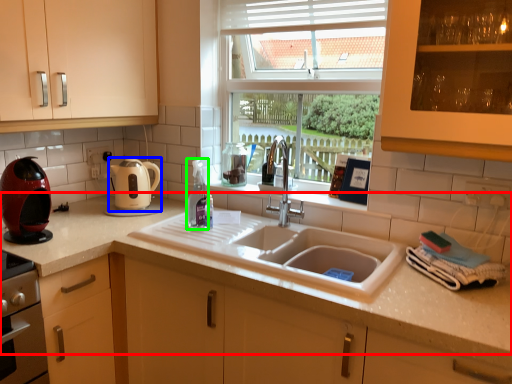
Question: Which object is positioned closest to countertop (highlighted by a red box)? Select from kitchen appliance (highlighted by a blue box) and bottle (highlighted by a green box).

Choices:
 (A) kitchen appliance
 (B) bottle

Answer: (A)